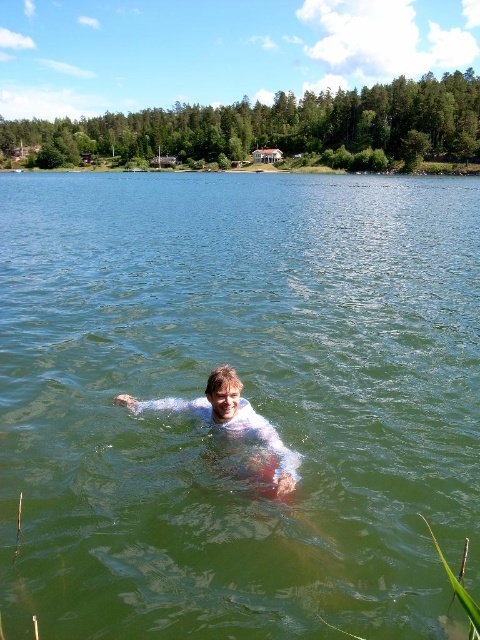
Does green liquid water at center appear over white matte skin at center?

Yes.

Does green liquid water at center have a lesser height compared to white matte skin at center?

No.

Find the location of a particular element. green liquid water at center is located at coordinates (244, 394).

At what (x,y) coordinates should I click in order to perform the action: click on green liquid water at center. Please return your answer as a coordinate pair (x, y). This screenshot has width=480, height=640. Looking at the image, I should click on (244, 394).